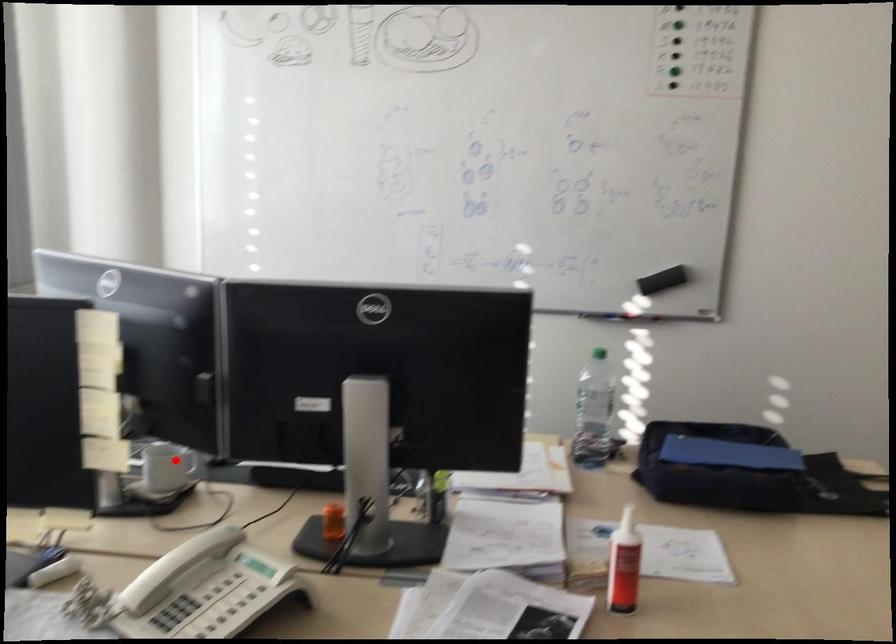
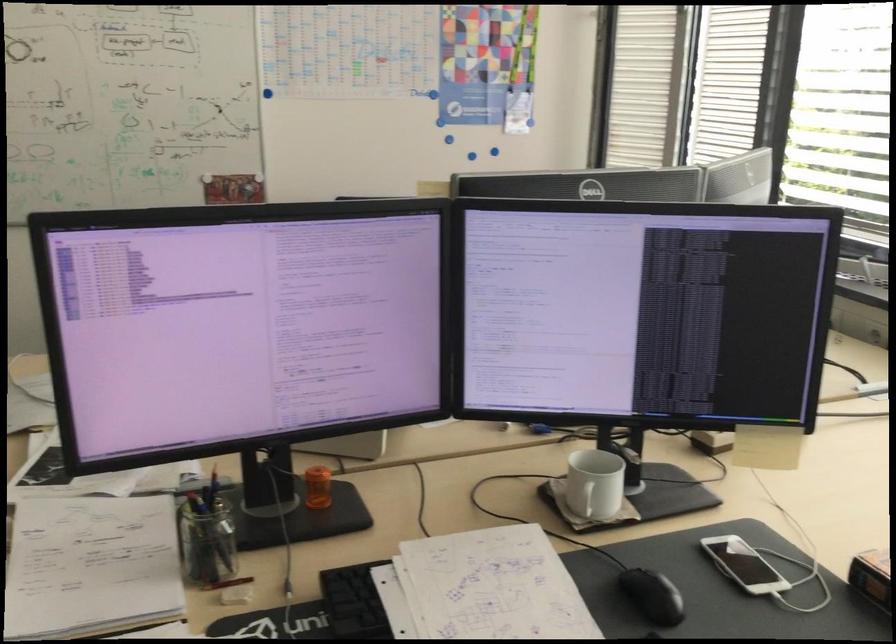
In the second image, find the point that corresponds to the highlighted location in the first image.

(583, 498)